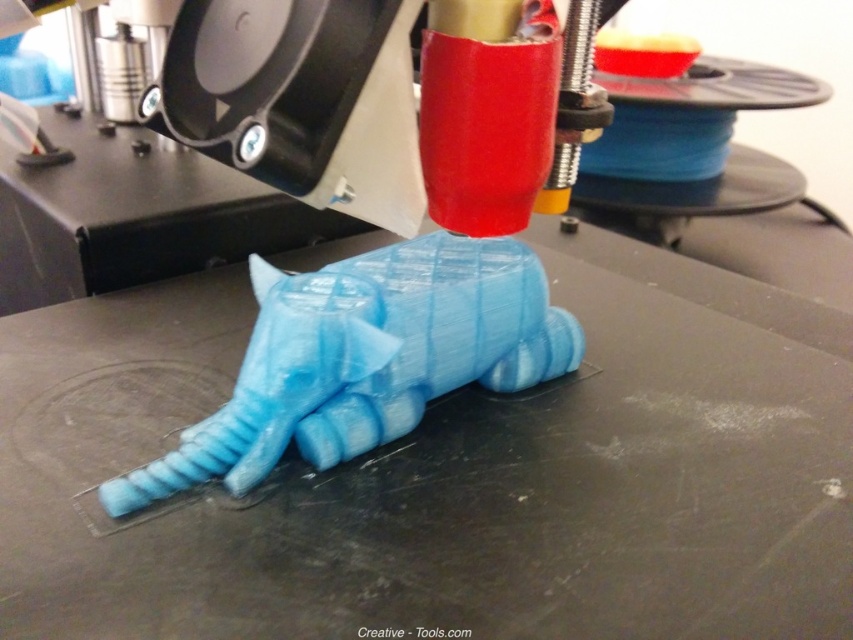
Is point (349, 538) closer to viewer compared to point (207, 474)?

Yes, it is.

Can you confirm if blue matte elephant at center is positioned below blue glossy elephant at center?

Correct, blue matte elephant at center is located below blue glossy elephant at center.

What do you see at coordinates (451, 474) in the screenshot? This screenshot has width=853, height=640. I see `blue matte elephant at center` at bounding box center [451, 474].

Where is `blue matte elephant at center`? blue matte elephant at center is located at coordinates (451, 474).